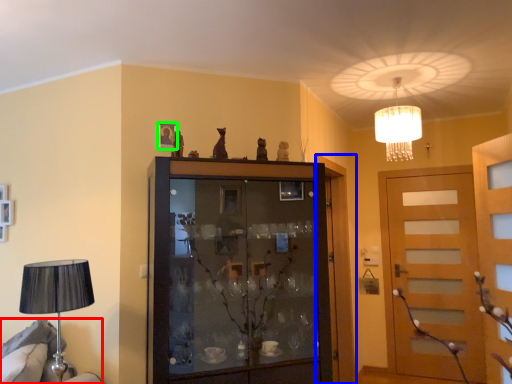
Question: Considering the real-world distances, which object is farthest from furniture (highlighted by a red box)? door (highlighted by a blue box) or picture frame (highlighted by a green box)?

Choices:
 (A) door
 (B) picture frame

Answer: (A)